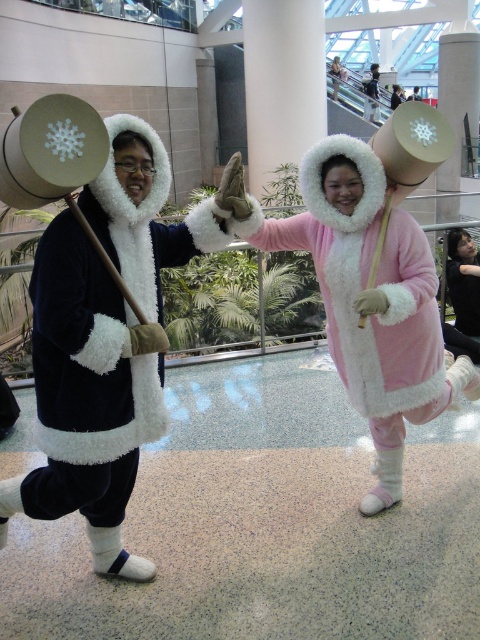
Can you confirm if velvet black coat at left is positioned below matte pink plush coat at center?

Yes, velvet black coat at left is below matte pink plush coat at center.

Who is more forward, (124, 225) or (324, 202)?

Point (124, 225) is more forward.

The image size is (480, 640). I want to click on velvet black coat at left, so click(x=86, y=397).

Between matte pink plush coat at center and velvet pink dress at center, which one appears on the right side from the viewer's perspective?

From the viewer's perspective, velvet pink dress at center appears more on the right side.

Can you confirm if matte pink plush coat at center is positioned to the right of velvet pink dress at center?

Incorrect, matte pink plush coat at center is not on the right side of velvet pink dress at center.

Which is behind, point (392, 227) or point (472, 310)?

The point (472, 310) is behind.

The height and width of the screenshot is (640, 480). I want to click on matte pink plush coat at center, so click(x=368, y=298).

Does velvet black coat at left have a greater height compared to velvet pink dress at center?

Correct, velvet black coat at left is much taller as velvet pink dress at center.

Where is `velvet black coat at left`? The height and width of the screenshot is (640, 480). velvet black coat at left is located at coordinates (86, 397).